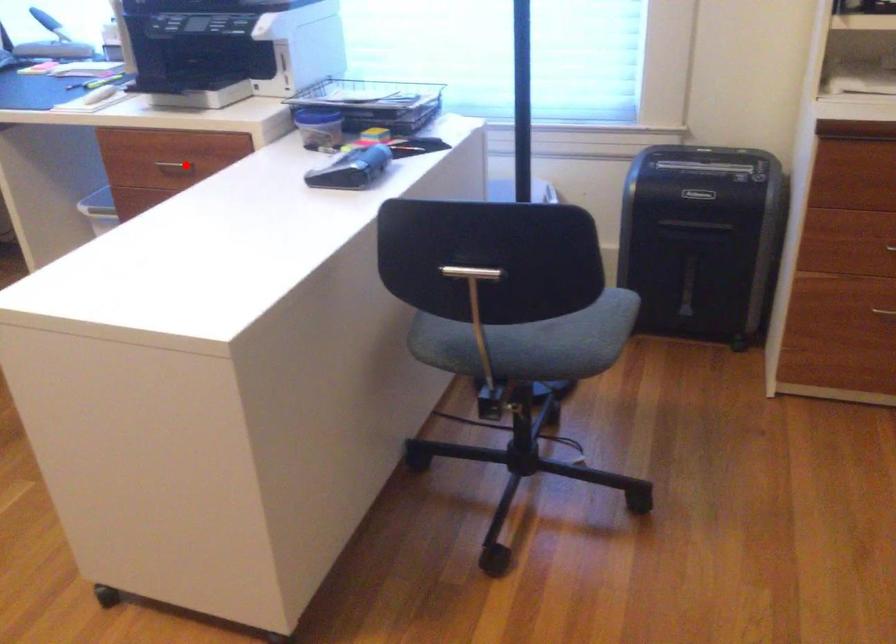
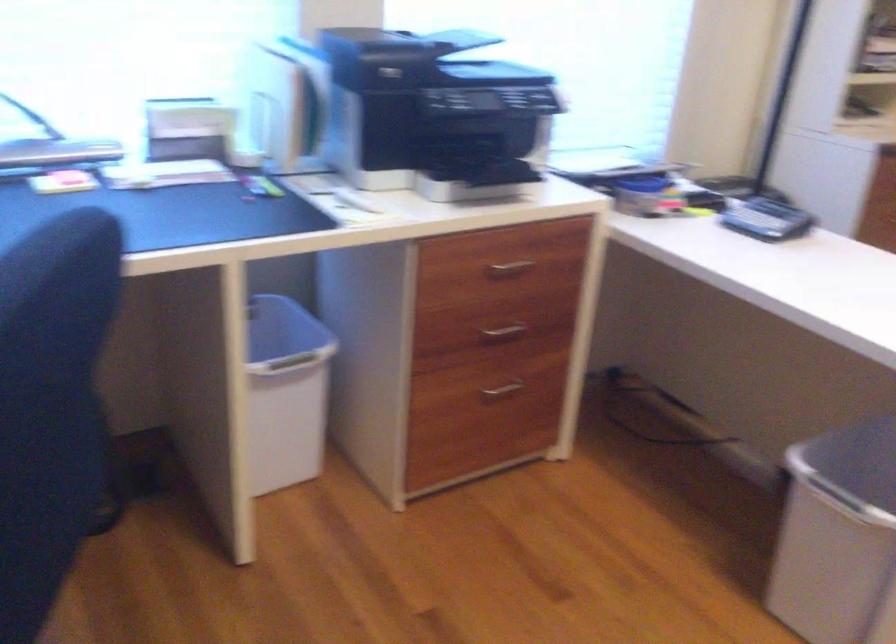
Question: I am providing you with two images of the same scene from different viewpoints. Image1 has a red point marked. In image2, the corresponding 3D location appears at what relative position? Reply with the corresponding letter.

Choices:
 (A) Closer
 (B) Farther

Answer: (A)